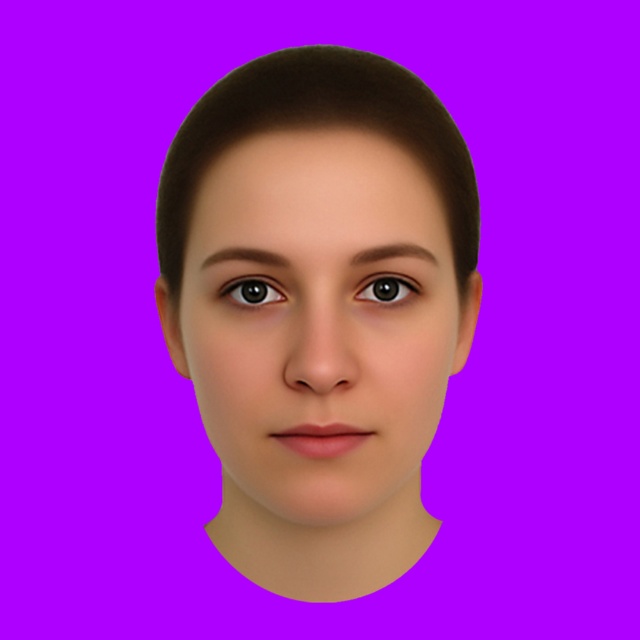
Between point (202, 372) and point (342, 81), which one is positioned in front?

Point (342, 81) is more forward.

Does smooth skin face at center lie behind brown matte hair at center?

No, it is not.

This screenshot has height=640, width=640. I want to click on smooth skin face at center, so click(317, 321).

Between brown matte hair at center and brown glossy eye at upper left, which one has less height?

brown glossy eye at upper left is shorter.

Is brown matte hair at center shorter than brown glossy eye at upper left?

In fact, brown matte hair at center may be taller than brown glossy eye at upper left.

Measure the distance between brown matte hair at center and camera.

A distance of 12.51 inches exists between brown matte hair at center and camera.

Locate an element on the screen. brown matte hair at center is located at coordinates (316, 125).

Between smooth skin face at center and brown glossy eye at upper left, which one is positioned lower?

smooth skin face at center is lower down.

Does smooth skin face at center have a larger size compared to brown glossy eye at upper left?

Correct, smooth skin face at center is larger in size than brown glossy eye at upper left.

Is point (209, 332) behind point (276, 296)?

Yes, it is.

In order to click on smooth skin face at center in this screenshot , I will do `click(317, 321)`.